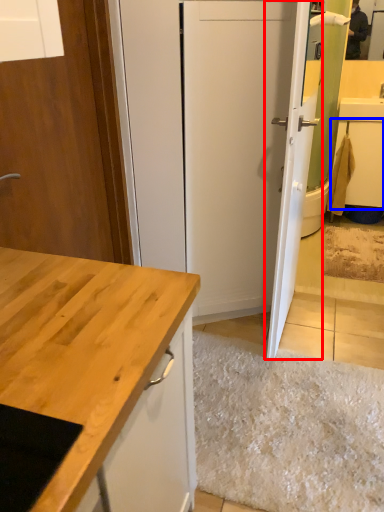
Question: Among these objects, which one is farthest to the camera, door (highlighted by a red box) or cabinetry (highlighted by a blue box)?

Choices:
 (A) door
 (B) cabinetry

Answer: (B)